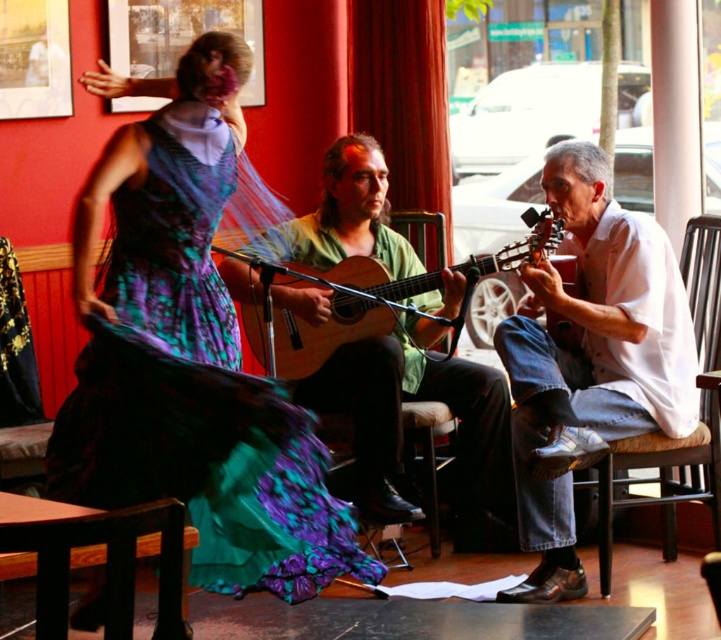
Question: Which point appears farthest from the camera in this image?

Choices:
 (A) (301, 337)
 (B) (425, 228)

Answer: (B)

Question: Is white cotton shirt at right thinner than green matte guitar at center?

Choices:
 (A) yes
 (B) no

Answer: (A)

Question: Can you confirm if matte green and purple fabric dress at center is smaller than brown wooden chair at right?

Choices:
 (A) no
 (B) yes

Answer: (A)

Question: Which object is closer to the camera taking this photo?

Choices:
 (A) wooden acoustic guitar at center
 (B) matte green and purple fabric dress at center
 (C) green matte guitar at center

Answer: (B)

Question: From the image, what is the correct spatial relationship of white cotton shirt at right in relation to brown wooden chair at right?

Choices:
 (A) right
 (B) left

Answer: (B)

Question: Which of the following is the farthest from the observer?

Choices:
 (A) green matte guitar at center
 (B) wooden acoustic guitar at center
 (C) wooden chair at center

Answer: (C)